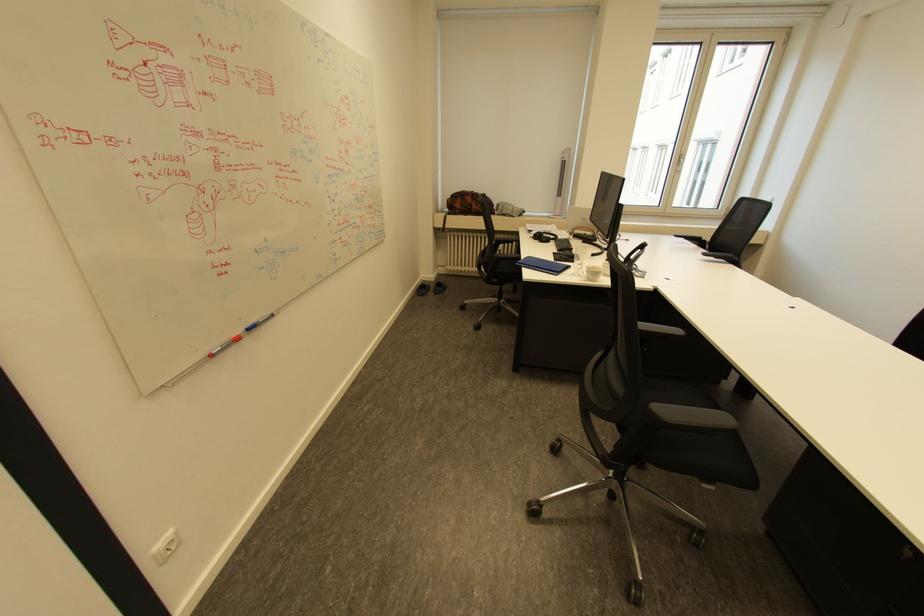
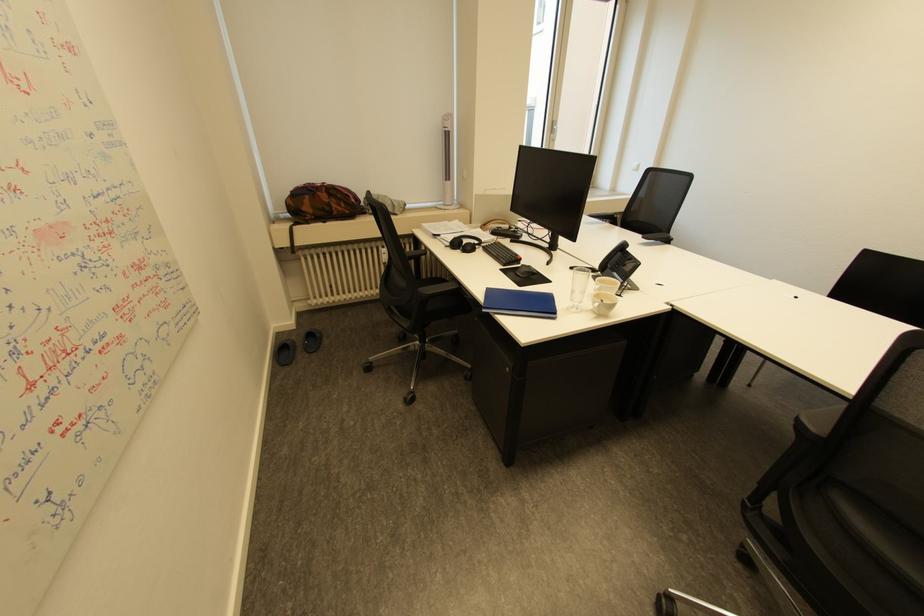
Where in the second image is the point corresponding to point (524, 264) from the first image?

(491, 310)